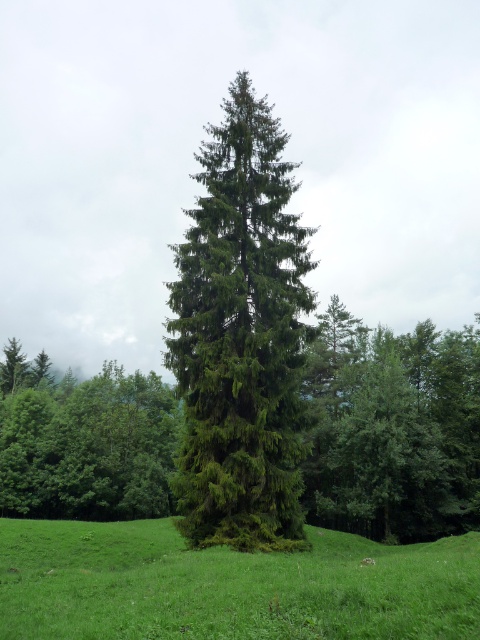
You are standing at the center of the grassy field and want to walk directly towards the green textured tree at center. Since the tree is positioned at coordinates point 0.530, 0.502, which direction should you head?

The green textured tree at center is located at point (x=240, y=339), so you should head towards the center of the field to reach it.

You are an environmental scientist analyzing the image. You need to determine which object has a smaller width between the green textured tree at center and the green grassy field at center. Which one is it?

The green textured tree at center is thinner than the green grassy field at center, so the green textured tree at center has a smaller width.